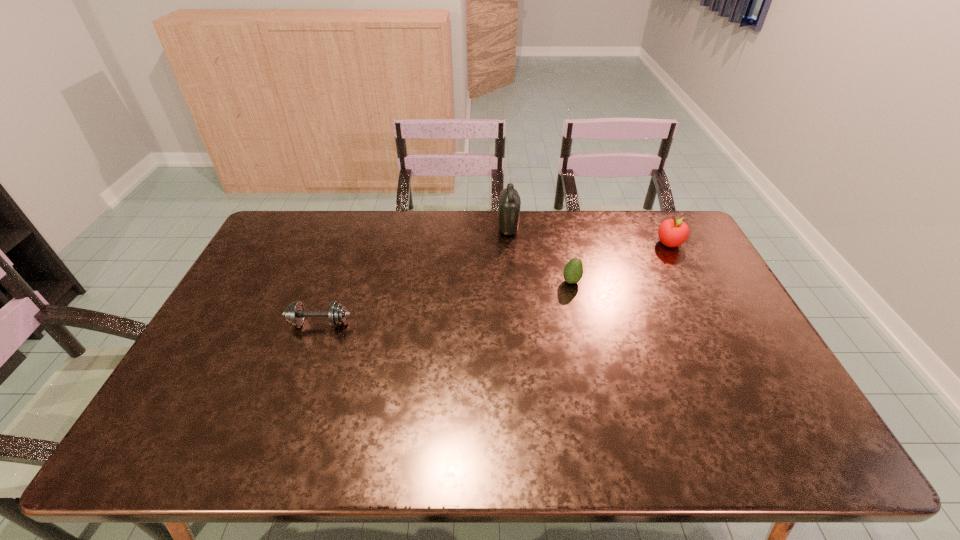
Locate an element on the screen. This screenshot has height=540, width=960. blank space located 0.110m on the right of the avocado is located at coordinates pyautogui.click(x=615, y=281).

Locate an element on the screen. vacant point located 0.250m on the front of the shortest object is located at coordinates (287, 414).

Locate an element on the screen. Image resolution: width=960 pixels, height=540 pixels. bottle at the far edge is located at coordinates pyautogui.click(x=509, y=200).

At what (x,y) coordinates should I click in order to perform the action: click on apple that is at the far edge. Please return your answer as a coordinate pair (x, y). Looking at the image, I should click on (673, 232).

The image size is (960, 540). I want to click on object that is at the right edge, so click(x=673, y=232).

Where is `object that is at the far right corner`? The image size is (960, 540). object that is at the far right corner is located at coordinates (673, 232).

Identify the location of vacant region at the far edge of the desktop. (432, 229).

Identify the location of free space at the near edge. The image size is (960, 540). (646, 428).

Where is `blank space at the left edge of the desktop`? The height and width of the screenshot is (540, 960). blank space at the left edge of the desktop is located at coordinates (266, 270).

The width and height of the screenshot is (960, 540). I want to click on vacant space at the far left corner of the desktop, so (274, 229).